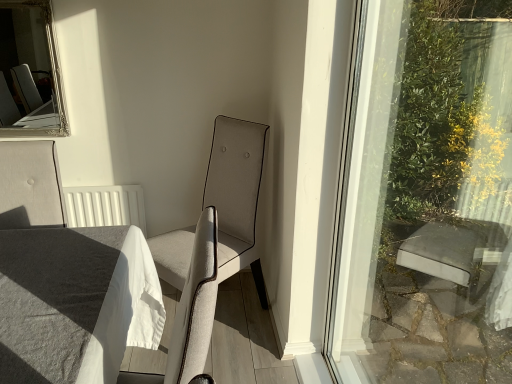
Question: Are light beige fabric chair at center and white linen table at lower left beside each other?

Choices:
 (A) no
 (B) yes

Answer: (A)

Question: Can you confirm if light beige fabric chair at center is wider than white linen table at lower left?

Choices:
 (A) no
 (B) yes

Answer: (B)

Question: Does light beige fabric chair at center come in front of white linen table at lower left?

Choices:
 (A) yes
 (B) no

Answer: (B)

Question: Is light beige fabric chair at center bigger than white linen table at lower left?

Choices:
 (A) no
 (B) yes

Answer: (B)

Question: Is light beige fabric chair at center smaller than white linen table at lower left?

Choices:
 (A) no
 (B) yes

Answer: (A)

Question: Is light beige fabric chair at center in front of or behind silver/gilded mirror at upper left in the image?

Choices:
 (A) front
 (B) behind

Answer: (A)

Question: In terms of height, does light beige fabric chair at center look taller or shorter compared to silver/gilded mirror at upper left?

Choices:
 (A) tall
 (B) short

Answer: (A)

Question: Considering the relative positions of light beige fabric chair at center and silver/gilded mirror at upper left in the image provided, is light beige fabric chair at center to the left or to the right of silver/gilded mirror at upper left?

Choices:
 (A) left
 (B) right

Answer: (B)

Question: Does point (229, 187) appear closer or farther from the camera than point (11, 91)?

Choices:
 (A) farther
 (B) closer

Answer: (B)

Question: Is silver/gilded mirror at upper left wider or thinner than light beige fabric chair at center?

Choices:
 (A) thin
 (B) wide

Answer: (A)

Question: Is silver/gilded mirror at upper left inside the boundaries of light beige fabric chair at center, or outside?

Choices:
 (A) inside
 (B) outside

Answer: (B)

Question: In terms of size, does silver/gilded mirror at upper left appear bigger or smaller than light beige fabric chair at center?

Choices:
 (A) big
 (B) small

Answer: (B)

Question: Considering the positions of silver/gilded mirror at upper left and light beige fabric chair at center in the image, is silver/gilded mirror at upper left taller or shorter than light beige fabric chair at center?

Choices:
 (A) tall
 (B) short

Answer: (B)

Question: Considering the positions of light beige fabric chair at center and white linen table at lower left in the image, is light beige fabric chair at center taller or shorter than white linen table at lower left?

Choices:
 (A) tall
 (B) short

Answer: (A)

Question: From the image's perspective, is light beige fabric chair at center above or below white linen table at lower left?

Choices:
 (A) below
 (B) above

Answer: (B)